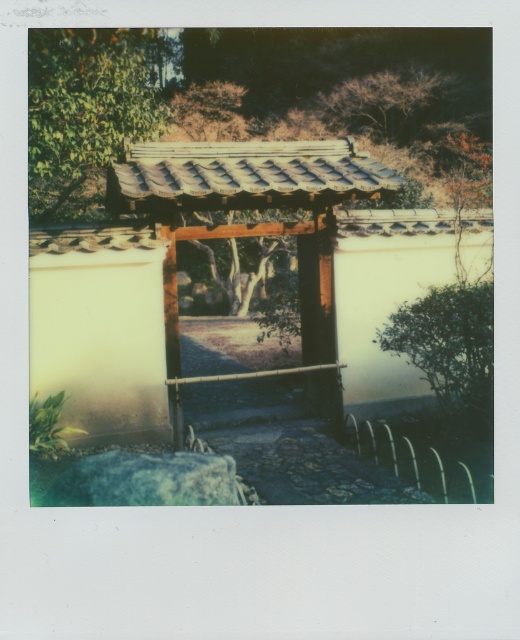
You are standing at the entrance of the torii gate and notice two trees in the scene. Which tree, the green leafy tree at right or the brown textured tree at upper center, is taller?

The brown textured tree at upper center is taller than the green leafy tree at right.

You are standing at the entrance of the torii gate and see two green leafy trees. One is labeled as the green leafy tree at upper left and the other as the green leafy tree at right. Which tree is located to the left of the other?

The green leafy tree at upper left is positioned on the left side of the green leafy tree at right.

You are standing at the torii gate and want to determine the position of two points marked in the image. Which point, point (263, 170) or point (385, 86), is closer to you?

Point (263, 170) is closer to the viewer than point (385, 86).